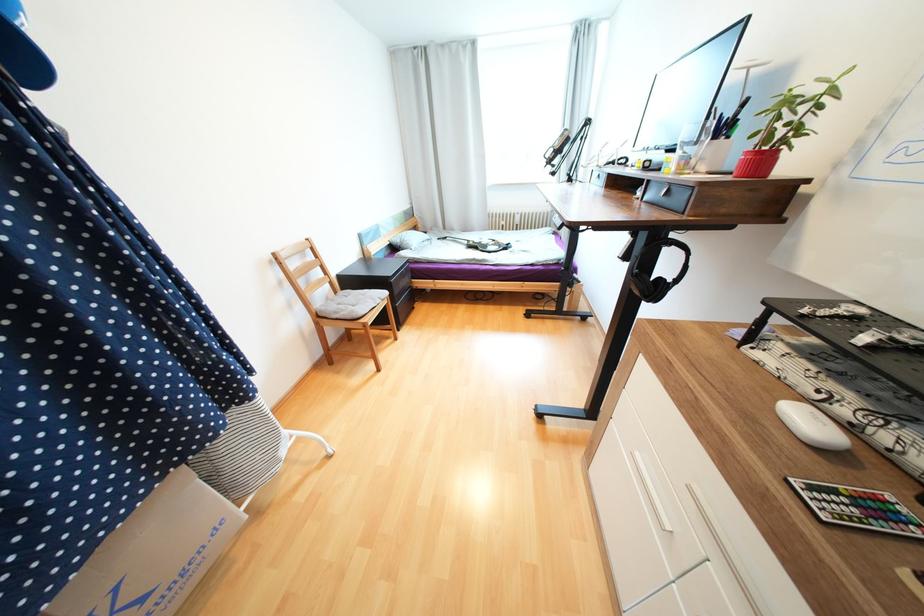
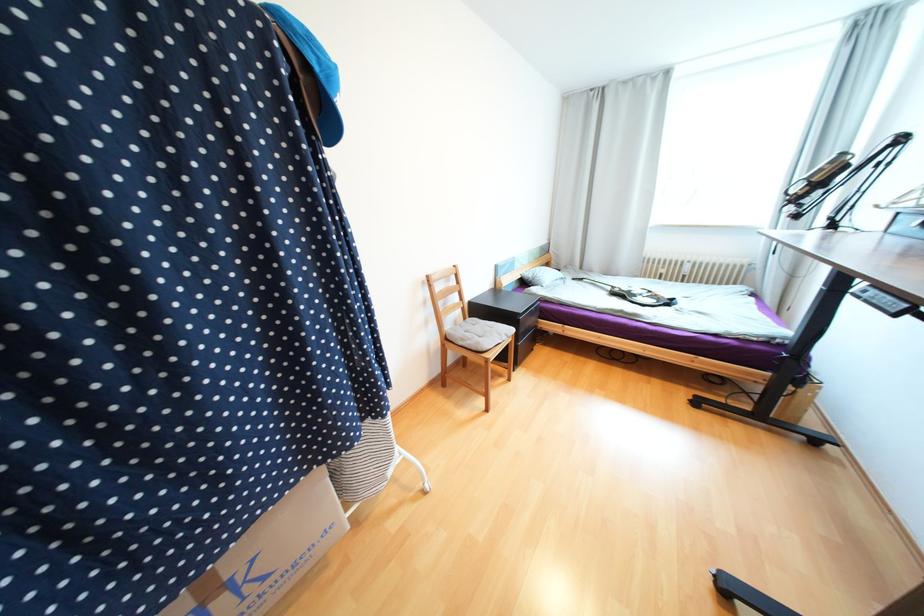
In the second image, find the point that corresponds to (x=471, y=243) in the first image.

(614, 288)